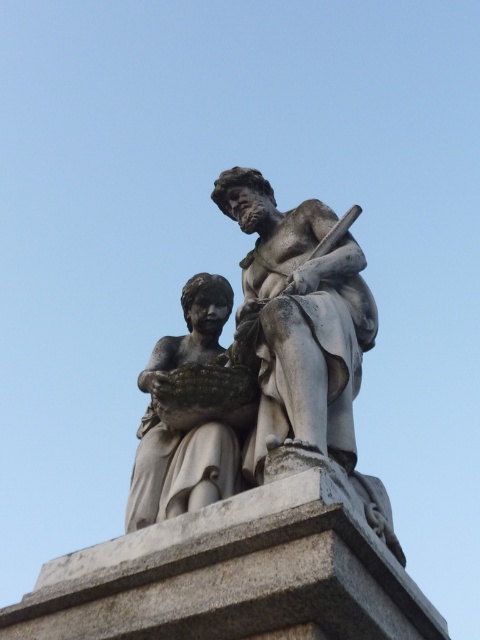
Question: Does gray stone pedestal at center have a smaller size compared to matte stone child at center?

Choices:
 (A) yes
 (B) no

Answer: (B)

Question: Which object is closer to the camera taking this photo?

Choices:
 (A) gray stone pedestal at center
 (B) matte stone child at center

Answer: (A)

Question: Does gray stone pedestal at center appear on the right side of matte stone child at center?

Choices:
 (A) no
 (B) yes

Answer: (B)

Question: Based on their relative distances, which object is nearer to the gray stone statue at center?

Choices:
 (A) matte stone child at center
 (B) gray stone pedestal at center

Answer: (A)

Question: Which object is the farthest from the gray stone statue at center?

Choices:
 (A) gray stone pedestal at center
 (B) matte stone child at center

Answer: (A)

Question: Can you confirm if gray stone statue at center is positioned below gray stone pedestal at center?

Choices:
 (A) no
 (B) yes

Answer: (A)